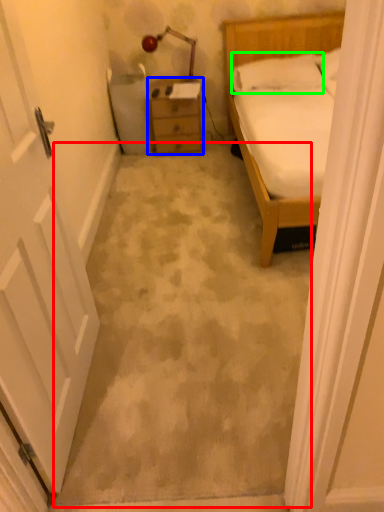
Question: Which is nearer to the concrete (highlighted by a red box)? chest of drawers (highlighted by a blue box) or pillow (highlighted by a green box).

Choices:
 (A) chest of drawers
 (B) pillow

Answer: (A)